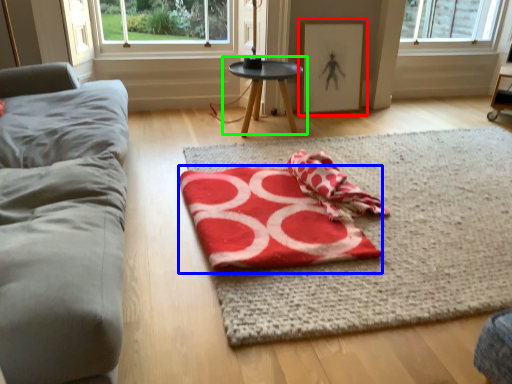
Question: Which object is positioned closest to picture frame (highlighted by a red box)? Select from beach towel (highlighted by a blue box) and table (highlighted by a green box).

Choices:
 (A) beach towel
 (B) table

Answer: (B)